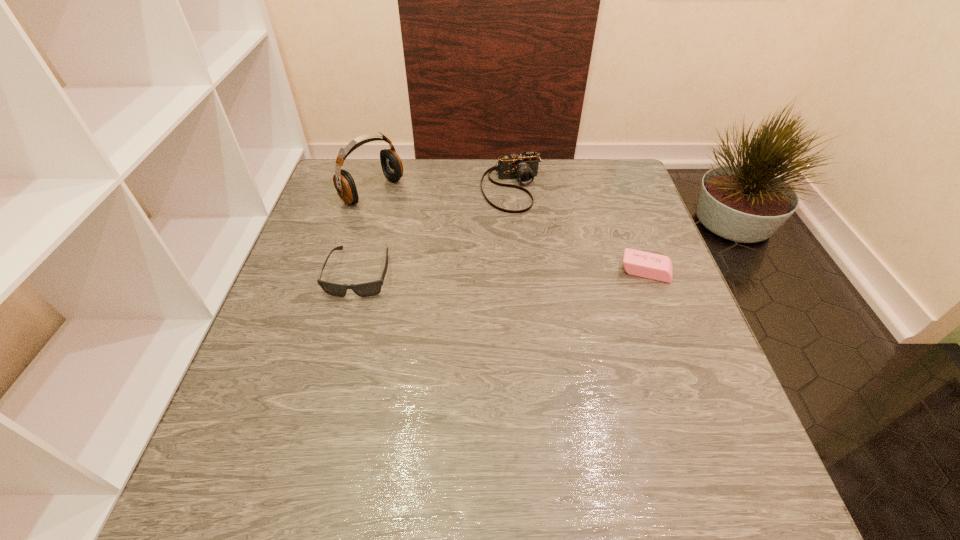
The image size is (960, 540). Identify the location of the third tallest object. (373, 288).

In order to click on eraser in this screenshot , I will do `click(648, 265)`.

The width and height of the screenshot is (960, 540). Identify the location of the shortest object. (648, 265).

Find the location of a particular element. The width and height of the screenshot is (960, 540). headset is located at coordinates (392, 167).

The image size is (960, 540). Identify the location of the second object from right to left. click(x=524, y=166).

You are a GUI agent. You are given a task and a screenshot of the screen. Output one action in this format:
    pyautogui.click(x=<x>, y=<y>)
    Task: Click on the camera
    The height and width of the screenshot is (540, 960).
    Given the screenshot: What is the action you would take?
    pyautogui.click(x=524, y=166)

Locate an element on the screen. The width and height of the screenshot is (960, 540). free space located on the front-facing side of the sunglasses is located at coordinates (327, 392).

Identify the location of free location located 0.160m on the back of the rightmost object. This screenshot has height=540, width=960. pyautogui.click(x=626, y=218).

Locate an element on the screen. The image size is (960, 540). vacant area located on the ear cups of the tallest object is located at coordinates (434, 231).

Identify the location of free spot located on the ear cups of the tallest object. pos(496,272).